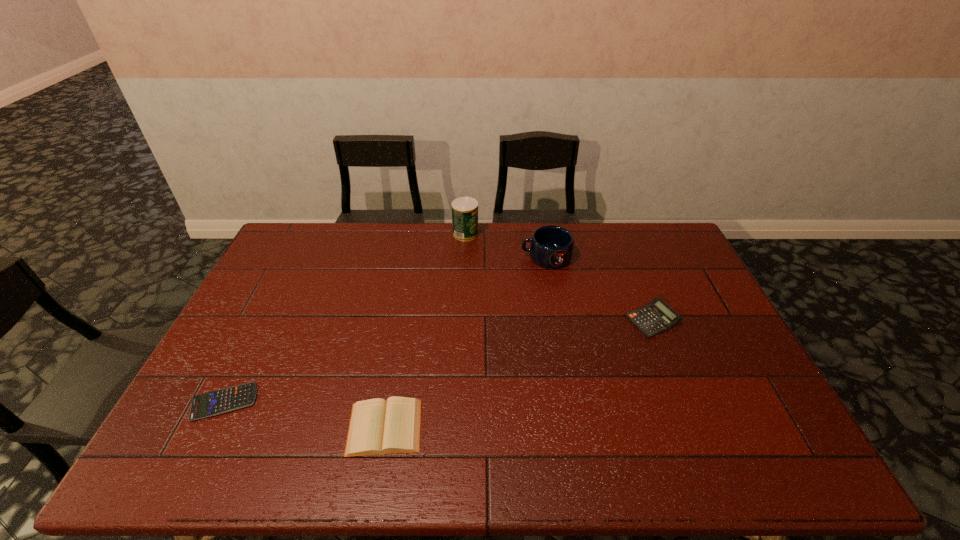
At what (x,y) coordinates should I click in order to perform the action: click on object positioned at the left edge. Please return your answer as a coordinate pair (x, y). Looking at the image, I should click on (x=217, y=402).

The height and width of the screenshot is (540, 960). In order to click on object at the right edge in this screenshot , I will do `click(656, 317)`.

This screenshot has height=540, width=960. In the image, there is a desktop. Identify the location of vacant space at the far edge. (529, 246).

In order to click on vacant space at the near edge of the desktop in this screenshot , I will do `click(406, 471)`.

This screenshot has width=960, height=540. Identify the location of free space at the left edge of the desktop. (193, 435).

The width and height of the screenshot is (960, 540). In the image, there is a desktop. Find the location of `vacant space at the right edge`. vacant space at the right edge is located at coordinates (684, 283).

The height and width of the screenshot is (540, 960). In the image, there is a desktop. In order to click on free region at the far right corner in this screenshot , I will do `click(649, 238)`.

The width and height of the screenshot is (960, 540). In order to click on free space at the near right corner of the desktop in this screenshot , I will do `click(786, 455)`.

Find the location of a particular element. free spot between the shorter calculator and the second shortest object is located at coordinates click(304, 414).

This screenshot has width=960, height=540. I want to click on vacant space in between the fourth tallest object and the farther calculator, so click(518, 374).